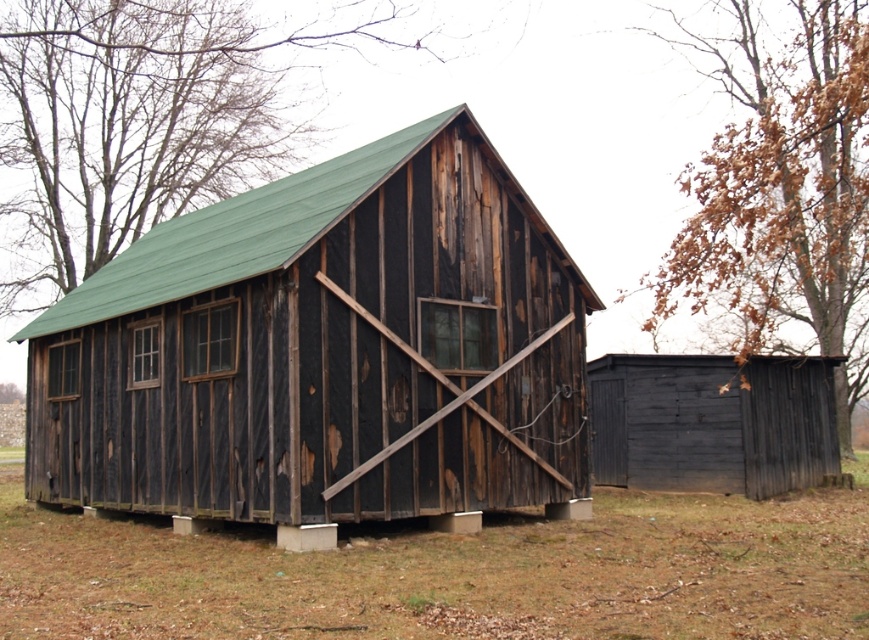
You are standing in front of the rusty wood barn at center and looking towards the brown wood tree at upper right. Is the tree above or below the barn?

The rusty wood barn at center is below the brown wood tree at upper right, so the tree is above the barn.

You are standing at the entrance of the rustic wooden shed and see two points marked on the ground. The first point is at coordinates point (363, 173) and the second is at point (493, 38). Which point is closer to you?

Point (363, 173) is in front of point (493, 38), so it is closer to you.

You are standing in front of the rustic wooden structure and notice two trees in the background. Which tree, the green wood tree at upper center or the brown wood tree at upper right, is closer to the structure?

Result: The green wood tree at upper center is closer to the structure because it has a smaller size compared to the brown wood tree at upper right.